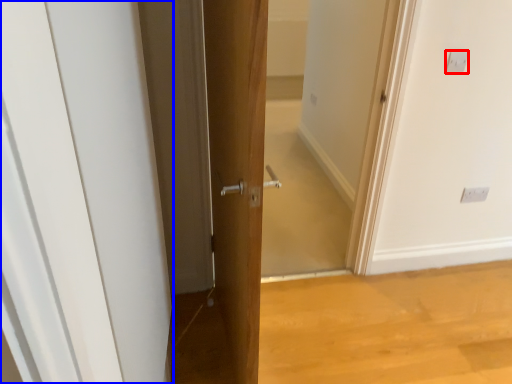
Question: Which object is closer to the camera taking this photo, electric outlet (highlighted by a red box) or door (highlighted by a blue box)?

Choices:
 (A) electric outlet
 (B) door

Answer: (B)